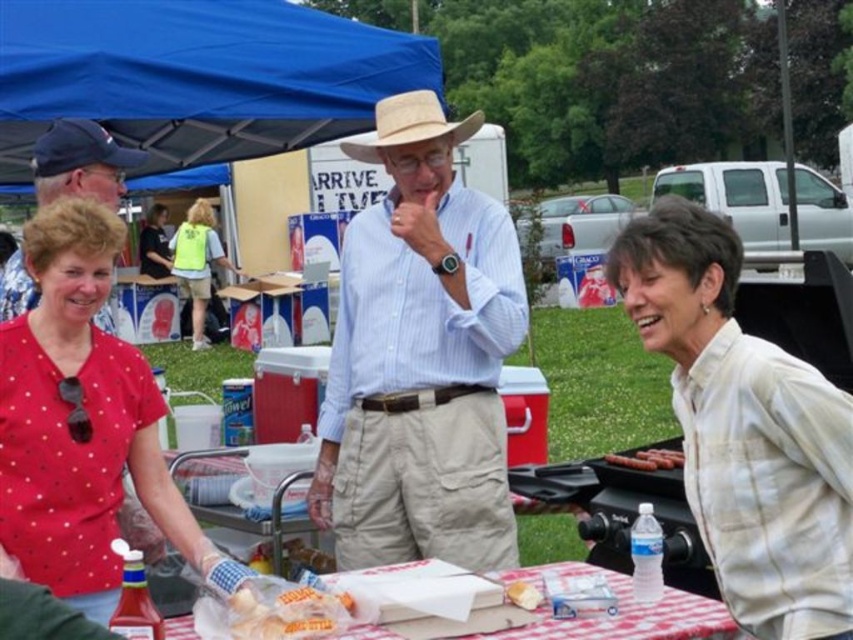
Is point (433, 92) farther from camera compared to point (521, 604)?

That is True.

Which is behind, point (451, 129) or point (531, 602)?

The point (451, 129) is behind.

Is point (389, 97) positioned in front of point (512, 600)?

No, (389, 97) is behind (512, 600).

Locate an element on the screen. The height and width of the screenshot is (640, 853). natural straw cowboy hat at center is located at coordinates (410, 124).

Does light blue striped shirt at center appear on the right side of natural straw cowboy hat at center?

Indeed, light blue striped shirt at center is positioned on the right side of natural straw cowboy hat at center.

Who is shorter, light blue striped shirt at center or natural straw cowboy hat at center?

natural straw cowboy hat at center is shorter.

Does point (364, 541) lie in front of point (466, 138)?

That is True.

Image resolution: width=853 pixels, height=640 pixels. I want to click on light blue striped shirt at center, so (421, 358).

Is light blue striped shirt at center shorter than golden bread at center?

In fact, light blue striped shirt at center may be taller than golden bread at center.

Which is above, light blue striped shirt at center or golden bread at center?

Positioned higher is light blue striped shirt at center.

The height and width of the screenshot is (640, 853). What do you see at coordinates (421, 358) in the screenshot?
I see `light blue striped shirt at center` at bounding box center [421, 358].

Find the location of `light blue striped shirt at center`. light blue striped shirt at center is located at coordinates (421, 358).